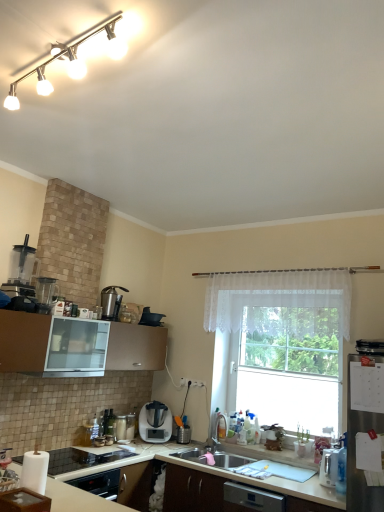
Identify the location of blank space to the left of metallic silver toaster at lower left, positioned as the 2th appliance in left-to-right order. The height and width of the screenshot is (512, 384). (73, 443).